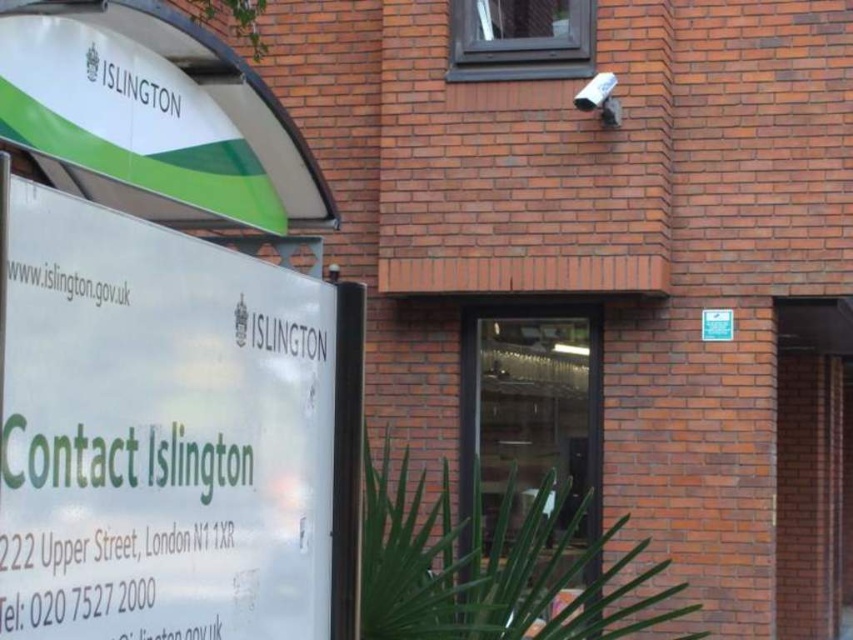
Who is positioned more to the right, white paper sign at left or transparent glass door at center?

Positioned to the right is transparent glass door at center.

Identify the location of white paper sign at left. The image size is (853, 640). (172, 435).